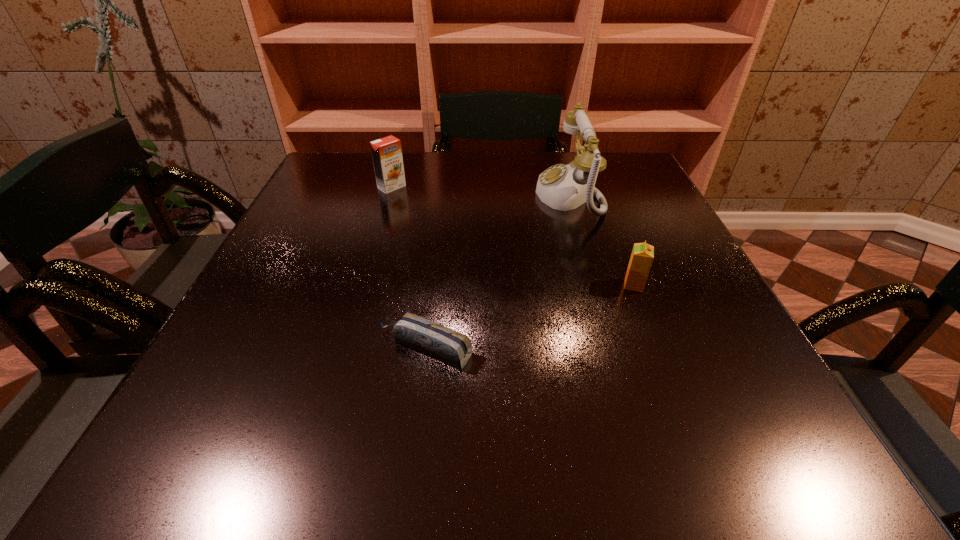
What are the coordinates of `free space that is in between the second tallest object and the nearer orange juice` in the screenshot? It's located at (513, 236).

You are a GUI agent. You are given a task and a screenshot of the screen. Output one action in this format:
    pyautogui.click(x=<x>, y=<y>)
    Task: Click on the free space between the leftmost object and the pencil box
    The height and width of the screenshot is (540, 960).
    Given the screenshot: What is the action you would take?
    pyautogui.click(x=408, y=268)

Image resolution: width=960 pixels, height=540 pixels. Identify the location of vacant space that is in between the shortest object and the tallest object. (497, 272).

Identify the location of vacant area that lies between the shortest object and the telephone. (497, 272).

I want to click on vacant space that is in between the second tallest object and the pencil box, so click(408, 268).

Where is `free space between the taller orange juice and the shorter orange juice`? This screenshot has height=540, width=960. free space between the taller orange juice and the shorter orange juice is located at coordinates (513, 236).

Locate an element on the screen. The height and width of the screenshot is (540, 960). object that stands as the third closest to the farther orange juice is located at coordinates (642, 256).

This screenshot has width=960, height=540. In order to click on object that is the third closest to the leftmost object in this screenshot , I will do `click(642, 256)`.

Where is `free space that satisfies the following two spatial constraints: 1. on the back side of the nearer orange juice; 2. on the right side of the pencil box`? free space that satisfies the following two spatial constraints: 1. on the back side of the nearer orange juice; 2. on the right side of the pencil box is located at coordinates (433, 285).

The width and height of the screenshot is (960, 540). Identify the location of vacant space that satisfies the following two spatial constraints: 1. on the front side of the pencil box; 2. on the left side of the taller orange juice. (344, 348).